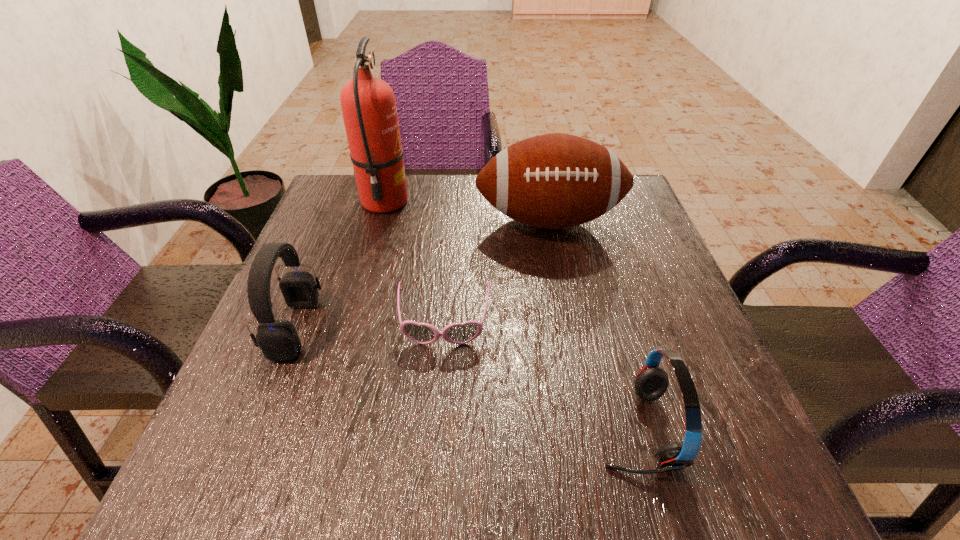
Where is `blank space located on the headband of the leftmost object`? Image resolution: width=960 pixels, height=540 pixels. blank space located on the headband of the leftmost object is located at coordinates (535, 328).

You are a GUI agent. You are given a task and a screenshot of the screen. Output one action in this format:
    pyautogui.click(x=<x>, y=<y>)
    Task: Click on the vacant space situated 0.310m with the microphone attached to the side of the nearer headset
    This screenshot has height=540, width=960.
    Given the screenshot: What is the action you would take?
    pyautogui.click(x=390, y=429)

Locate an element on the screen. free space located with the microphone attached to the side of the nearer headset is located at coordinates (430, 429).

The height and width of the screenshot is (540, 960). In order to click on free region located with the microphone attached to the side of the nearer headset in this screenshot , I will do point(564,429).

Identify the location of vacant area situated 0.060m on the front-facing side of the shortest object. Image resolution: width=960 pixels, height=540 pixels. (440, 380).

Image resolution: width=960 pixels, height=540 pixels. I want to click on fire extinguisher that is at the far edge, so [x=368, y=104].

At what (x,y) coordinates should I click in order to perform the action: click on football situated at the far edge. Please return your answer as a coordinate pair (x, y). The width and height of the screenshot is (960, 540). Looking at the image, I should click on (553, 181).

Identify the location of object present at the near edge. (651, 382).

At what (x,y) coordinates should I click in order to perform the action: click on fire extinguisher that is at the left edge. Please return your answer as a coordinate pair (x, y). Image resolution: width=960 pixels, height=540 pixels. Looking at the image, I should click on (368, 104).

This screenshot has height=540, width=960. Identify the location of headset positioned at the left edge. (278, 340).